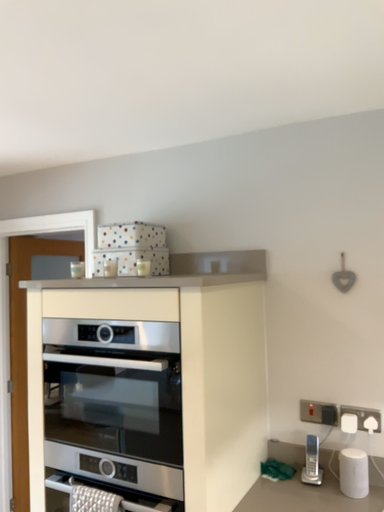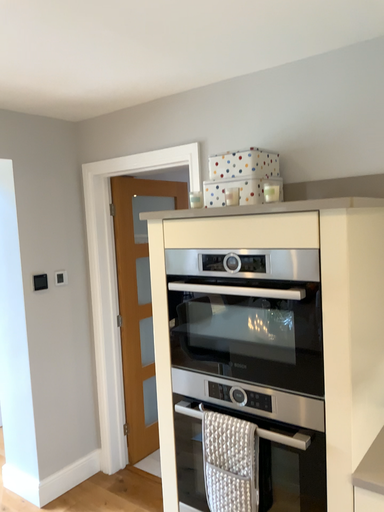
Question: Which way did the camera rotate in the video?

Choices:
 (A) rotated upward
 (B) rotated downward

Answer: (B)